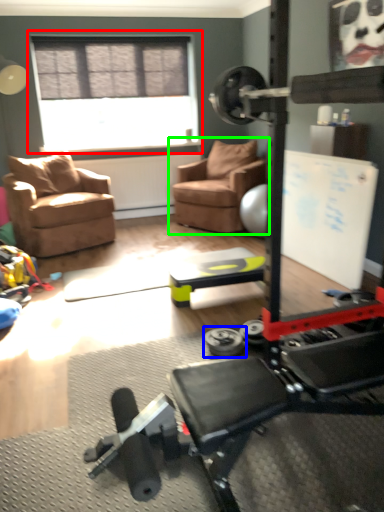
Question: Which is farther away from window (highlighted by a red box)? dumbbell (highlighted by a blue box) or chair (highlighted by a green box)?

Choices:
 (A) dumbbell
 (B) chair

Answer: (A)